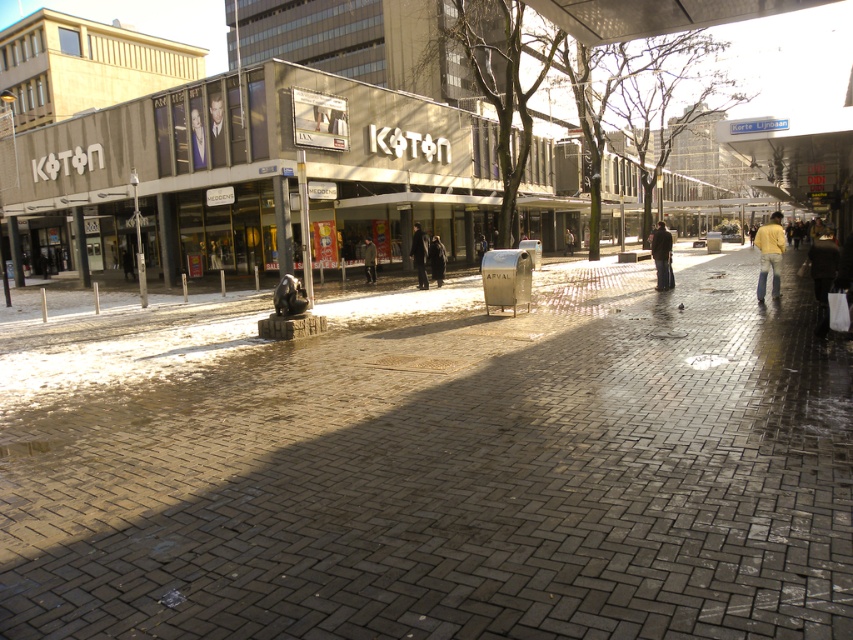
You are a delivery person trying to deliver a package to the KOTON building. You see the brick paved sidewalk at center and the dark green jacket at center. Which object is taller?

The brick paved sidewalk at center is much taller than the dark green jacket at center.

You are a delivery person needing to place a small package on the ground between the dark brown leather jacket at lower right and the dark green jacket at center. Considering their heights, which jacket should you place the package closer to?

The dark brown leather jacket at lower right is much taller than the dark green jacket at center, so placing the package closer to the dark green jacket at center would be better to avoid blocking the view of the taller jacket.

You are a delivery person trying to avoid puddles on the wet brick walkway. You need to place a package on the dark brown leather jacket at lower right. Based on the scene description, where exactly should you place the package to ensure it stays dry?

The dark brown leather jacket at lower right is located at point [822,275]. Since the jacket is at this coordinate, you should place the package near that location but check for nearby puddles described in the scene to ensure it stays dry.